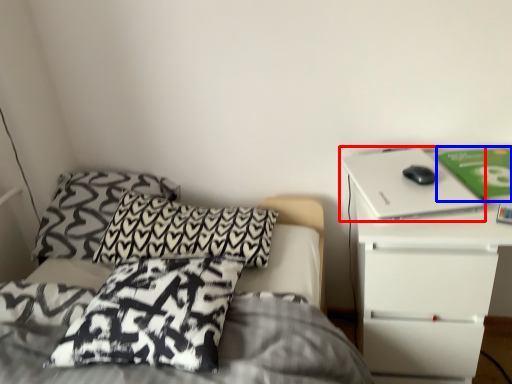
Question: Which point is further to the camera, computer (highlighted by a red box) or paperback book (highlighted by a blue box)?

Choices:
 (A) computer
 (B) paperback book

Answer: (B)